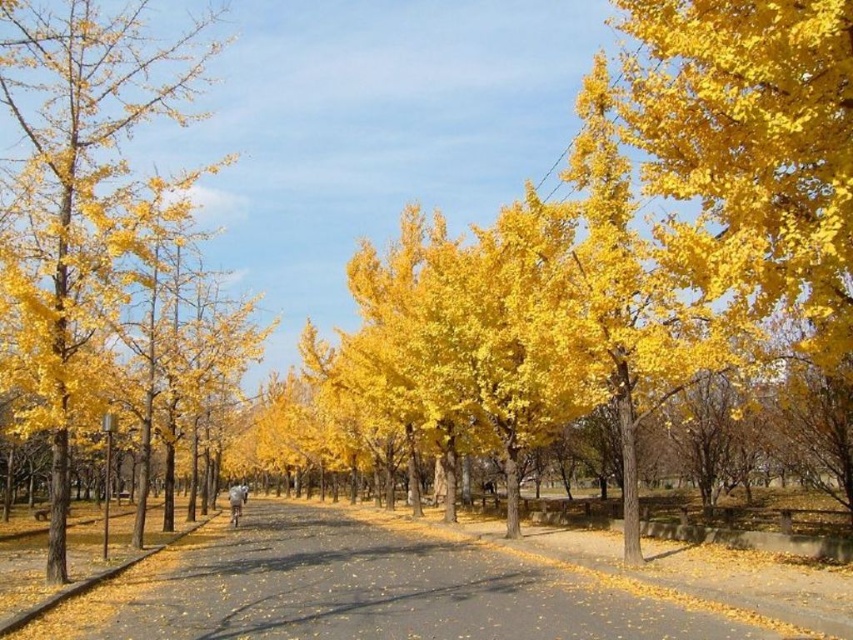
You are standing on the pathway and want to take a photo of the yellow asphalt road at center and the yellow leafy tree at left. Which object should you focus on first to ensure both are in focus?

You should focus on the yellow leafy tree at left first because it is farther away from you than the yellow asphalt road at center, so adjusting focus from far to near can help both be in focus.

You are standing at the starting point of the pathway and need to reach the yellow asphalt road at center. According to the coordinates provided, where exactly should you head to find it?

The yellow asphalt road at center is located at the coordinates point (378, 593), so you should head towards that specific point to find it.